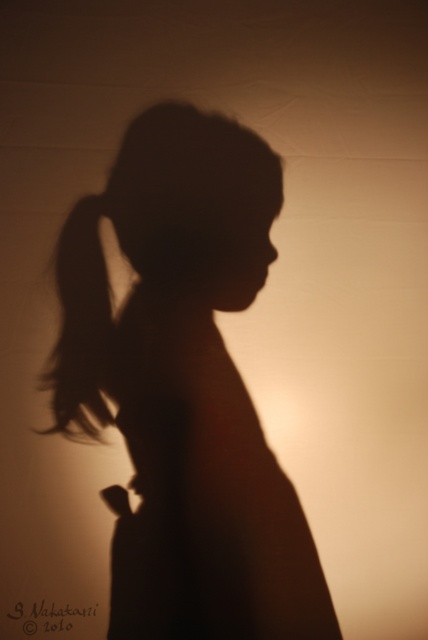
Question: Is silhouette figure at center wider than black hair at left?

Choices:
 (A) no
 (B) yes

Answer: (B)

Question: Is silhouette figure at center positioned before black hair at left?

Choices:
 (A) yes
 (B) no

Answer: (A)

Question: Can you confirm if silhouette figure at center is smaller than black hair at left?

Choices:
 (A) yes
 (B) no

Answer: (B)

Question: Which point is closer to the camera?

Choices:
 (A) (51, 428)
 (B) (115, 529)

Answer: (B)